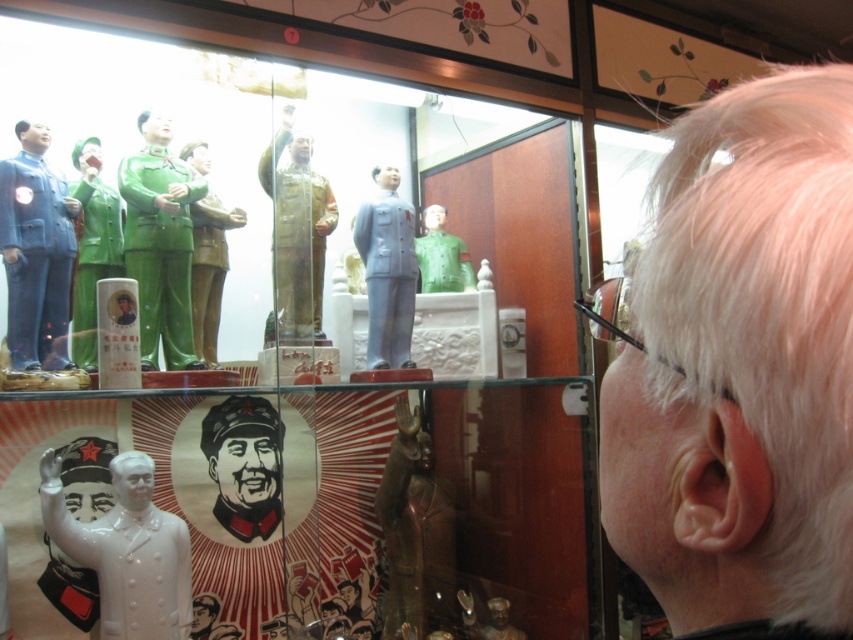
Is matte blue statue at left thinner than metallic gold statue at center?

Indeed, matte blue statue at left has a lesser width compared to metallic gold statue at center.

Between matte blue statue at left and metallic gold statue at center, which one is positioned lower?

Positioned lower is matte blue statue at left.

In order to click on matte blue statue at left in this screenshot , I will do `click(36, 252)`.

The image size is (853, 640). In order to click on matte blue statue at left in this screenshot , I will do `click(36, 252)`.

Is green glossy statue at upper left bigger than matte porcelain figure at center?

Indeed, green glossy statue at upper left has a larger size compared to matte porcelain figure at center.

Is point (190, 330) in front of point (393, 204)?

Yes, it is.

In order to click on green glossy statue at upper left in this screenshot , I will do `click(160, 243)`.

Between matte blue statue at left and green glossy statue at left, which one appears on the right side from the viewer's perspective?

green glossy statue at left

Can you confirm if matte blue statue at left is taller than green glossy statue at left?

No.

Between point (15, 220) and point (82, 240), which one is positioned in front?

Point (15, 220) is more forward.

This screenshot has height=640, width=853. Find the location of `matte blue statue at left`. matte blue statue at left is located at coordinates (36, 252).